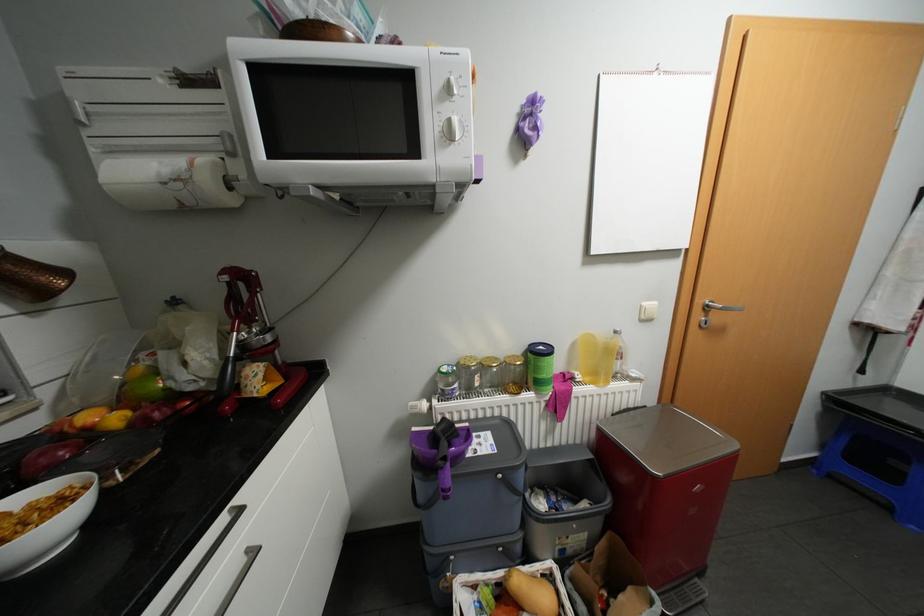
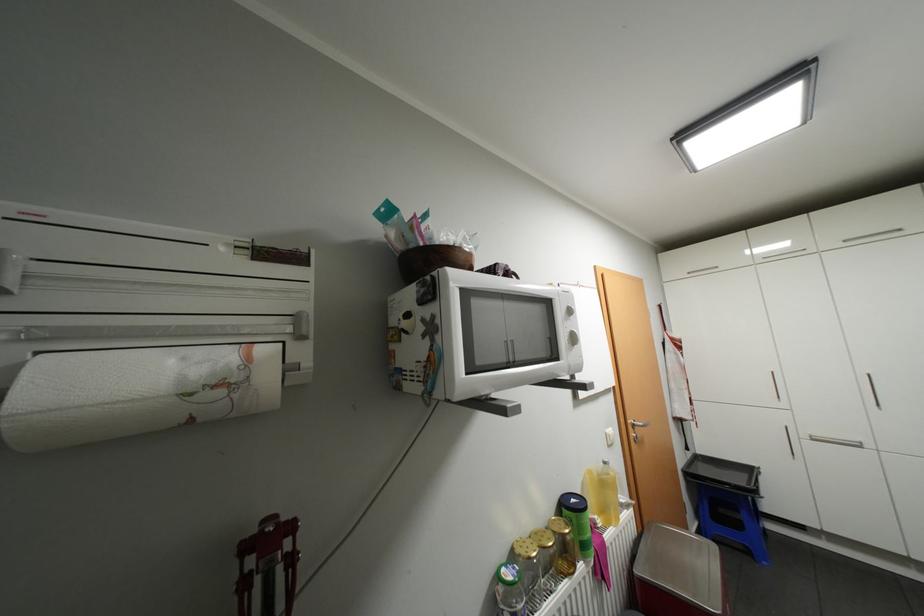
Where in the second image is the point corresponding to point (238, 153) from the first image?

(309, 336)